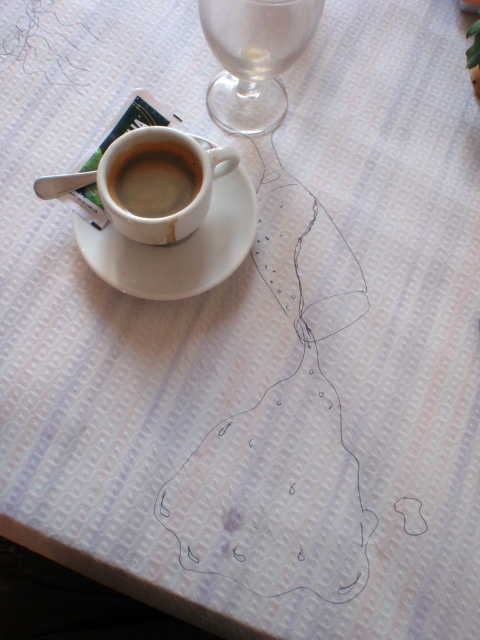
From the picture: Can you confirm if white ceramic saucer at center is thinner than matte ceramic cup at center?

Incorrect, white ceramic saucer at center's width is not less than matte ceramic cup at center's.

I want to click on white ceramic saucer at center, so click(x=178, y=248).

Where is `white ceramic saucer at center`? The image size is (480, 640). white ceramic saucer at center is located at coordinates (178, 248).

Can you confirm if transparent glass wine glass at upper right is taller than white ceramic saucer at center?

No.

Is transparent glass wine glass at upper right to the right of white ceramic saucer at center from the viewer's perspective?

Indeed, transparent glass wine glass at upper right is positioned on the right side of white ceramic saucer at center.

The width and height of the screenshot is (480, 640). I want to click on transparent glass wine glass at upper right, so click(253, 58).

This screenshot has height=640, width=480. Identify the location of transparent glass wine glass at upper right. (253, 58).

Does point (249, 67) lie in front of point (173, 156)?

That is False.

Is transparent glass wine glass at upper right to the left of matte ceramic cup at center from the viewer's perspective?

Incorrect, transparent glass wine glass at upper right is not on the left side of matte ceramic cup at center.

Is point (247, 12) farther from viewer compared to point (169, 205)?

No, (247, 12) is in front of (169, 205).

This screenshot has width=480, height=640. In order to click on transparent glass wine glass at upper right in this screenshot , I will do `click(253, 58)`.